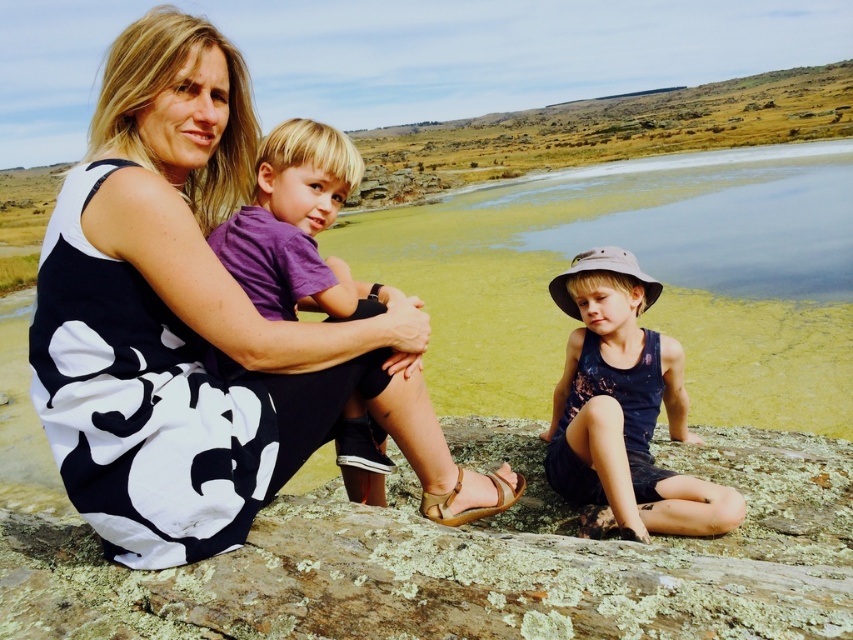
In the serene outdoor scene, there are two people wearing a black floral dress at center and a purple cotton shirt at center. Which one is positioned to the left?

The black floral dress at center is to the left of the purple cotton shirt at center.